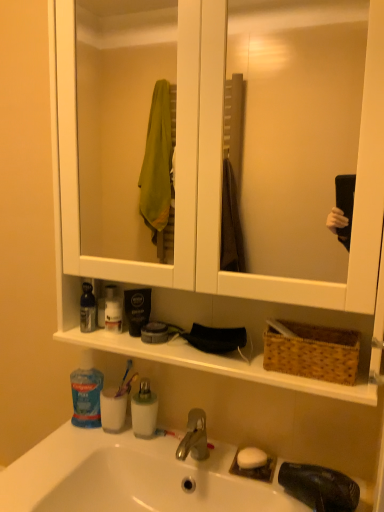
The image size is (384, 512). What are the coordinates of `space that is in front of translucent plastic toothbrush at lower center, which ranks as the 2th toothbrush in right-to-left order` in the screenshot? It's located at (111, 443).